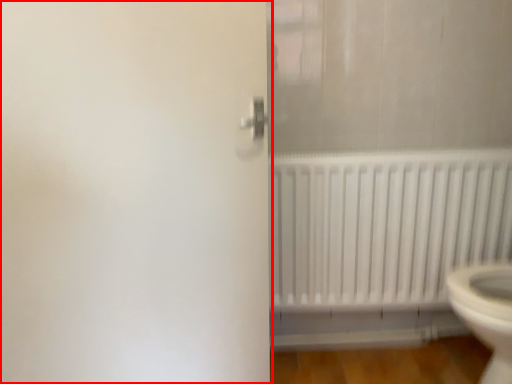
Question: From the image's perspective, where is screen door (annotated by the red box) located relative to radiator?

Choices:
 (A) above
 (B) below

Answer: (A)